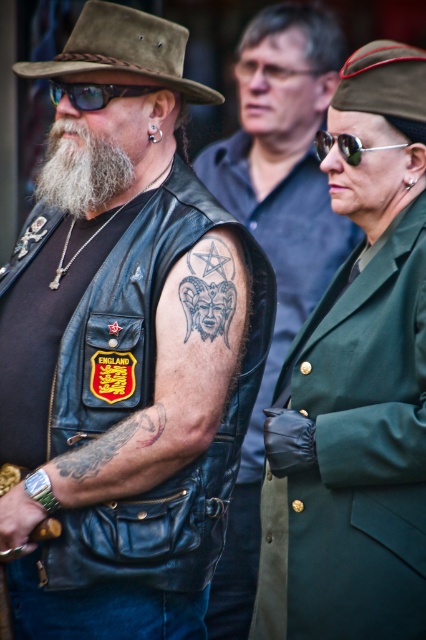
Between black leather tattoo at lower left and matte black goggles at center, which one is positioned lower?

black leather tattoo at lower left

Is black leather tattoo at lower left to the right of matte black goggles at center from the viewer's perspective?

Yes, black leather tattoo at lower left is to the right of matte black goggles at center.

In order to click on black leather tattoo at lower left in this screenshot , I will do `click(111, 444)`.

Does graywool-likebeard at left have a greater height compared to sunglasses at center?

Yes, graywool-likebeard at left is taller than sunglasses at center.

Is graywool-likebeard at left shorter than sunglasses at center?

No.

Does point (115, 156) come closer to viewer compared to point (356, 152)?

That is False.

Find the location of a particular element. This screenshot has width=426, height=640. graywool-likebeard at left is located at coordinates (81, 170).

Who is more distant from viewer, (x=236, y=225) or (x=94, y=93)?

The point (x=236, y=225) is behind.

You are a GUI agent. You are given a task and a screenshot of the screen. Output one action in this format:
    pyautogui.click(x=<x>, y=<y>)
    Task: Click on the leather vest at center
    
    Given the screenshot: What is the action you would take?
    pyautogui.click(x=120, y=355)

Is point (190, 502) closer to camera compared to point (108, 84)?

Yes, it is in front of point (108, 84).

The height and width of the screenshot is (640, 426). In order to click on leather vest at center in this screenshot , I will do `click(120, 355)`.